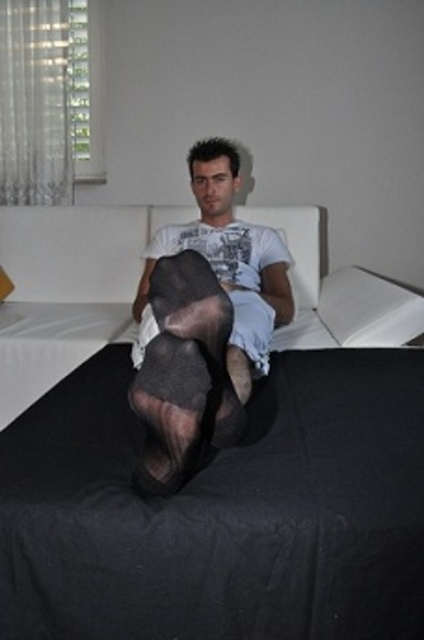
You are a photographer setting up a shoot in this room. You want to place a 40 cm wide decorative item between the matte black tights at center and the white fabric pillow at upper right. Is there enough space for it?

The distance between the matte black tights at center and the white fabric pillow at upper right is 39.00 centimeters. Since the decorative item is 40 cm wide, it would not fit in the available space.

You are a photographer trying to place a small decorative pillow in the scene. The pillow must be placed exactly at the point with coordinates point (212, 461). Where should you place the pillow in the image?

The point (212, 461) is on the black fabric bed at center, so you should place the pillow on the black fabric bed at center.

You are a photographer adjusting the lighting in the room. You notice a point at coordinates [184,372]. What object is located at that point?

The point at coordinates [184,372] indicates the black sheer stocking at center.